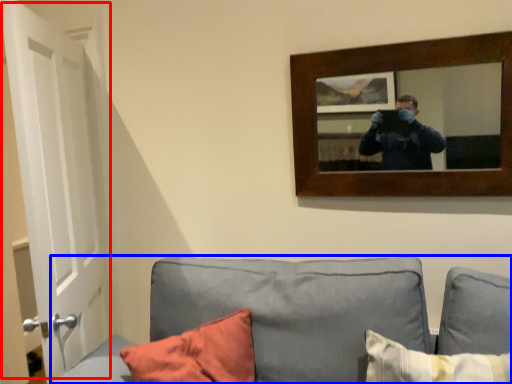
Question: Which point is closer to the camera, door (highlighted by a red box) or studio couch (highlighted by a blue box)?

Choices:
 (A) door
 (B) studio couch

Answer: (B)